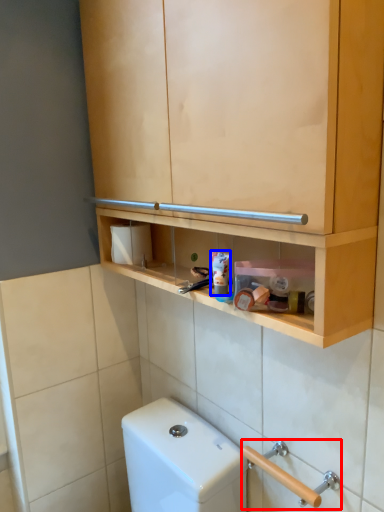
Question: Which object is closer to the camera taking this photo, door handle (highlighted by a red box) or toothpaste (highlighted by a blue box)?

Choices:
 (A) door handle
 (B) toothpaste

Answer: (A)